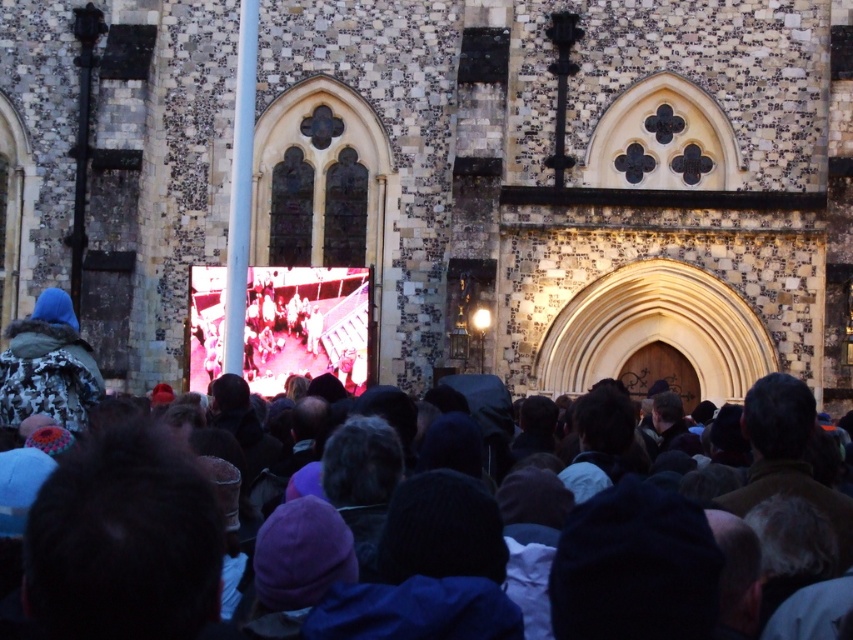
Question: Can you confirm if dark gray knit hats at center is positioned below camouflage jacket at left?

Choices:
 (A) no
 (B) yes

Answer: (B)

Question: Is stone textured church at center to the right of camouflage jacket at left from the viewer's perspective?

Choices:
 (A) yes
 (B) no

Answer: (A)

Question: Is stone textured church at center above dark gray knit hats at center?

Choices:
 (A) yes
 (B) no

Answer: (A)

Question: Which object is closer to the camera taking this photo?

Choices:
 (A) stone textured church at center
 (B) camouflage jacket at left

Answer: (B)

Question: Among these objects, which one is nearest to the camera?

Choices:
 (A) dark gray knit hats at center
 (B) stone textured church at center
 (C) camouflage jacket at left

Answer: (A)

Question: Which of the following is the closest to the observer?

Choices:
 (A) camouflage jacket at left
 (B) dark gray knit hats at center
 (C) stone textured church at center

Answer: (B)